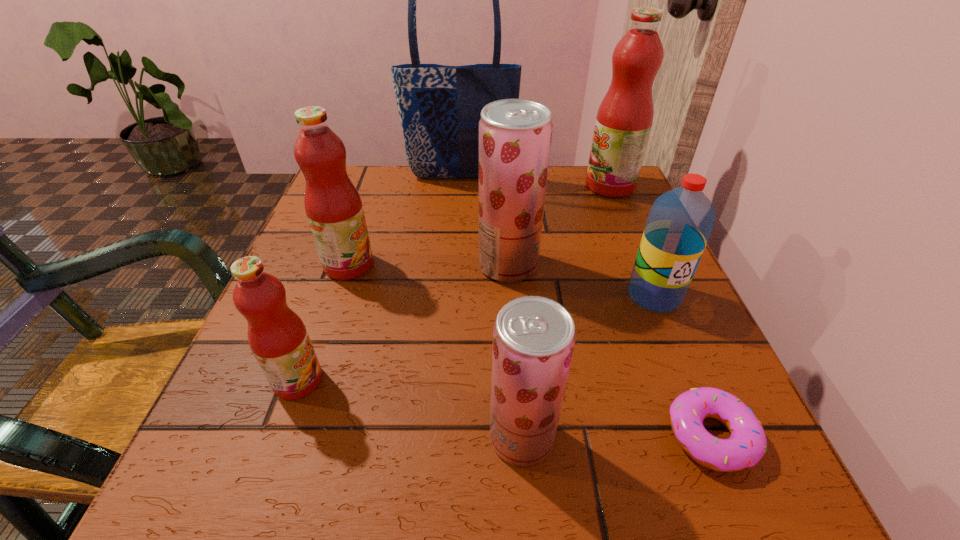
Identify the location of object that is at the near right corner. The image size is (960, 540). pos(747,444).

In the image, there is a desktop. Where is `vacant space at the far edge`? This screenshot has width=960, height=540. vacant space at the far edge is located at coordinates (470, 217).

This screenshot has height=540, width=960. In order to click on vacant space at the near edge of the desktop in this screenshot , I will do (461, 467).

Locate an element on the screen. free space at the left edge of the desktop is located at coordinates (320, 353).

The width and height of the screenshot is (960, 540). I want to click on vacant space at the right edge of the desktop, so click(x=623, y=247).

Where is `free space at the near left corner of the desktop`? The image size is (960, 540). free space at the near left corner of the desktop is located at coordinates (236, 450).

In order to click on vacant space at the far right corner of the desktop in this screenshot , I will do `click(581, 211)`.

Where is `vacant space at the near right corner of the desktop`? This screenshot has height=540, width=960. vacant space at the near right corner of the desktop is located at coordinates (725, 496).

Where is `unoccupied area between the farther strawberry fruit juice and the fourth farthest fruit juice`? This screenshot has width=960, height=540. unoccupied area between the farther strawberry fruit juice and the fourth farthest fruit juice is located at coordinates (403, 322).

This screenshot has height=540, width=960. I want to click on free point between the second farthest pink fruit juice and the bigger strawberry fruit juice, so click(428, 265).